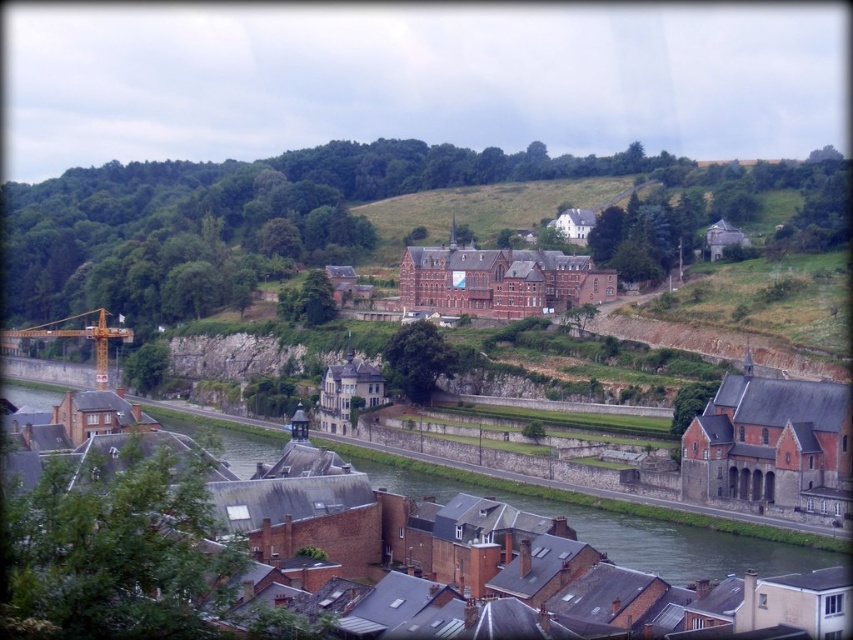
You are a delivery truck driver who needs to cross the gray concrete river at lower center to reach the town. However, there is a yellow metallic crane at left nearby. Considering the width of the river, do you think your truck can safely cross it without getting stuck?

The gray concrete river at lower center might be wider than the yellow metallic crane at left, so the truck driver should be cautious as the river could be too wide for safe passage. It is recommended to check the river width before proceeding.

You are standing at the point with coordinates point (105,330) and want to see the point with coordinates point (718,534). Is there any obstruction between you and the point?

Point (718,534) is in front of point (105,330), so there is no obstruction between you and the point.